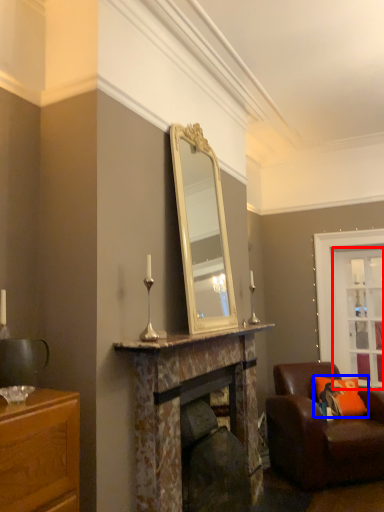
Question: Which object is further to the camera taking this photo, glass door (highlighted by a red box) or pillow (highlighted by a blue box)?

Choices:
 (A) glass door
 (B) pillow

Answer: (A)